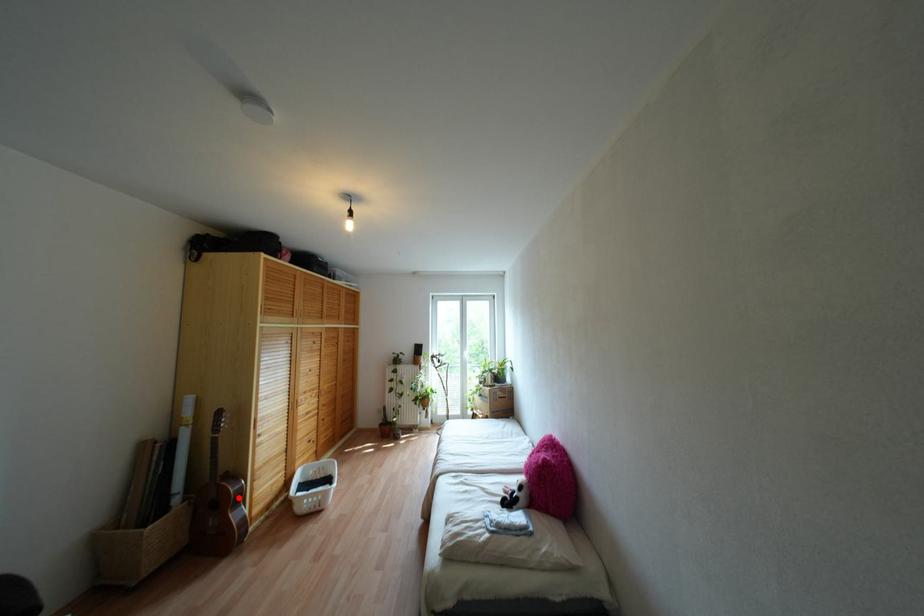
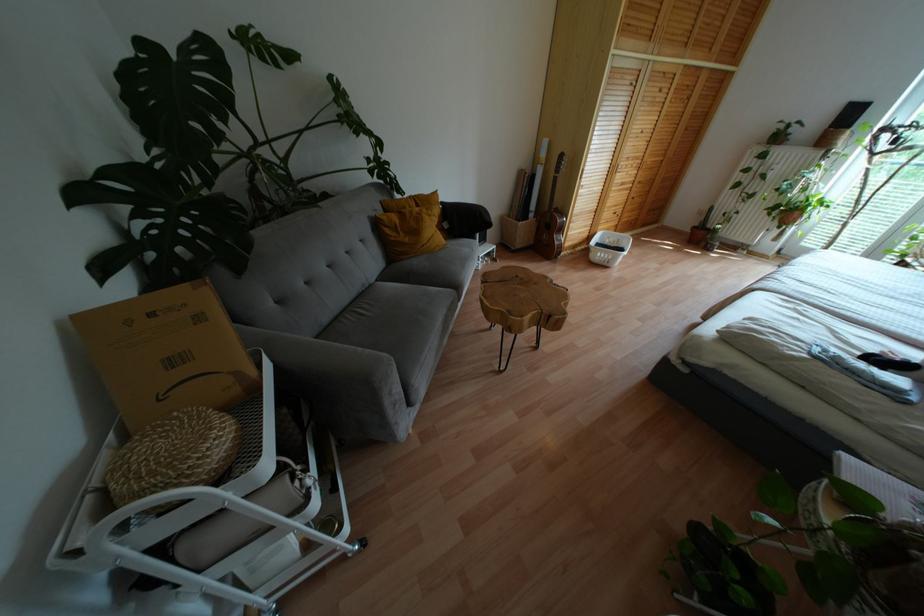
Question: A red point is marked in image1. In image2, is the corresponding 3D point closer to the camera or farther? Reply with the corresponding letter.

Choices:
 (A) The corresponding 3D point is closer.
 (B) The corresponding 3D point is farther.

Answer: (A)